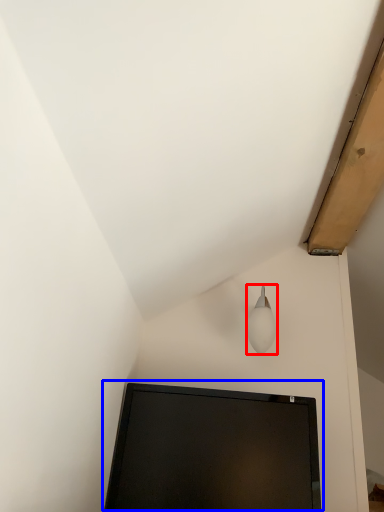
Question: Among these objects, which one is nearest to the camera, lamp (highlighted by a red box) or computer monitor (highlighted by a blue box)?

Choices:
 (A) lamp
 (B) computer monitor

Answer: (B)